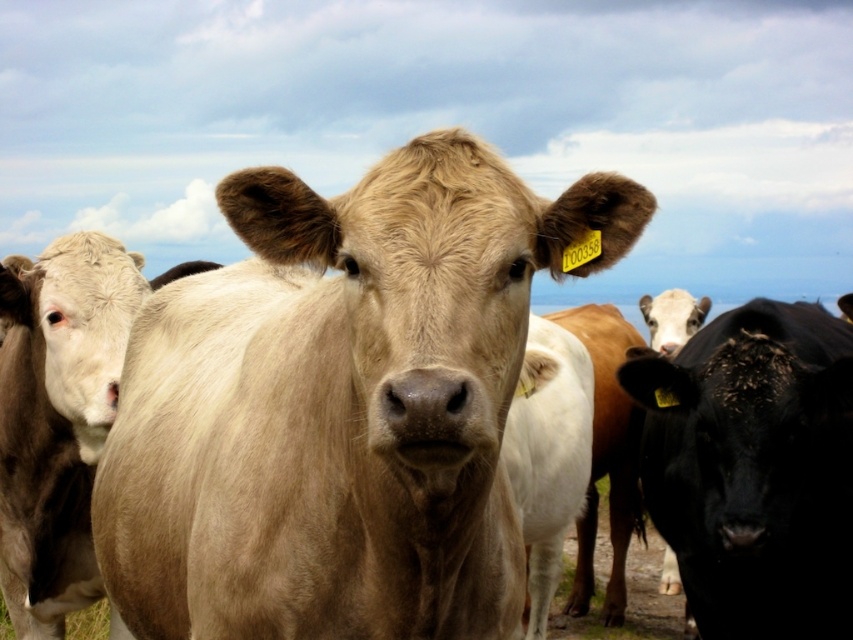
Which of these two, smooth tan cow at center or black glossy bull at right, stands shorter?

With less height is smooth tan cow at center.

Is smooth tan cow at center to the right of black glossy bull at right from the viewer's perspective?

In fact, smooth tan cow at center is to the left of black glossy bull at right.

The height and width of the screenshot is (640, 853). Identify the location of smooth tan cow at center. (340, 404).

Image resolution: width=853 pixels, height=640 pixels. Identify the location of smooth tan cow at center. (340, 404).